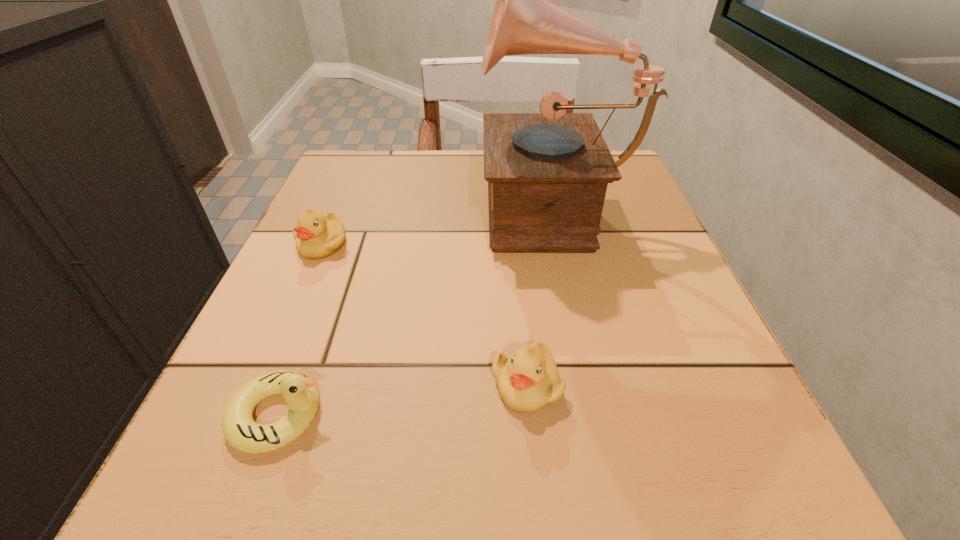
The width and height of the screenshot is (960, 540). Find the location of `record player`. record player is located at coordinates (547, 173).

Locate an element on the screen. the farthest duckling is located at coordinates (317, 236).

Where is `the rightmost duckling`? Image resolution: width=960 pixels, height=540 pixels. the rightmost duckling is located at coordinates (528, 380).

Locate an element on the screen. The width and height of the screenshot is (960, 540). vacant region located on the horn of the record player is located at coordinates (315, 206).

This screenshot has width=960, height=540. Find the location of `free spot located on the horn of the record player`. free spot located on the horn of the record player is located at coordinates (335, 206).

Where is `free space located 0.280m on the horn of the record player`? This screenshot has height=540, width=960. free space located 0.280m on the horn of the record player is located at coordinates (340, 206).

At what (x,y) coordinates should I click in order to perform the action: click on vacant area located on the front-facing side of the farthest duckling. Please return your answer as a coordinate pair (x, y). The height and width of the screenshot is (540, 960). Looking at the image, I should click on (288, 322).

This screenshot has width=960, height=540. I want to click on blank space located 0.070m on the front-facing side of the rightmost duckling, so click(535, 474).

The width and height of the screenshot is (960, 540). I want to click on object at the far edge, so click(x=547, y=173).

This screenshot has width=960, height=540. I want to click on object that is positioned at the near edge, so click(x=300, y=393).